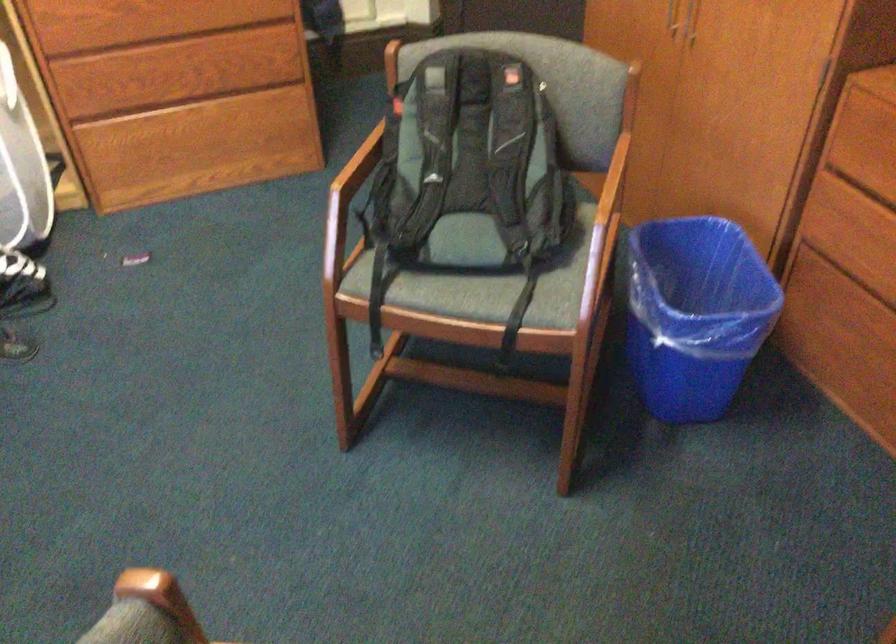
What are the coordinates of `blue trash can` in the screenshot? It's located at (694, 313).